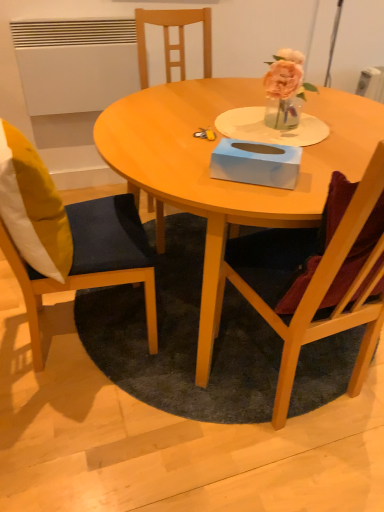
Identify the location of space that is in front of wooden chair at right, positioned as the first chair in right-to-left order. (294, 468).